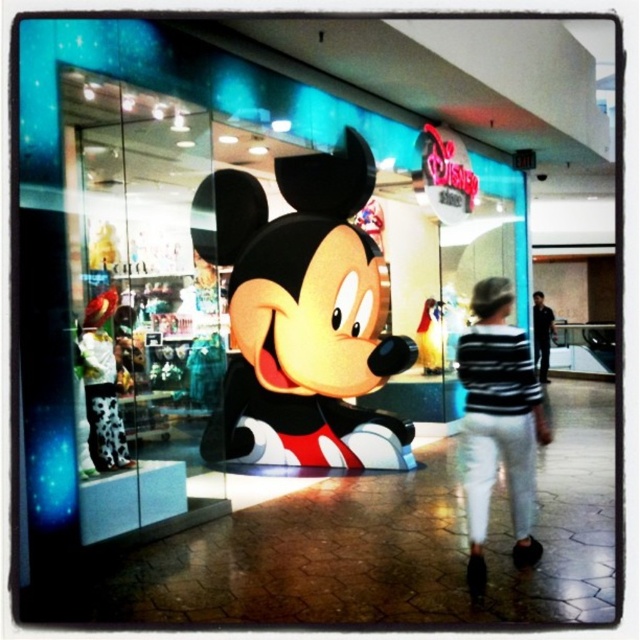
Question: Which point is closer to the camera?

Choices:
 (A) matte plastic mickey mouse at center
 (B) striped sweater at center

Answer: (B)

Question: Is matte plastic mickey mouse at center to the left of striped sweater at center from the viewer's perspective?

Choices:
 (A) no
 (B) yes

Answer: (B)

Question: Which object is positioned closest to the cow print fabric boot at lower left?

Choices:
 (A) black fabric shirt at right
 (B) striped sweater at center
 (C) matte plastic mickey mouse at center

Answer: (C)

Question: Does cow print fabric boot at lower left have a larger size compared to black fabric shirt at right?

Choices:
 (A) yes
 (B) no

Answer: (B)

Question: Does cow print fabric boot at lower left appear on the right side of black fabric shirt at right?

Choices:
 (A) no
 (B) yes

Answer: (A)

Question: Considering the real-world distances, which object is closest to the matte plastic mickey mouse at center?

Choices:
 (A) cow print fabric boot at lower left
 (B) striped sweater at center
 (C) black fabric shirt at right

Answer: (A)